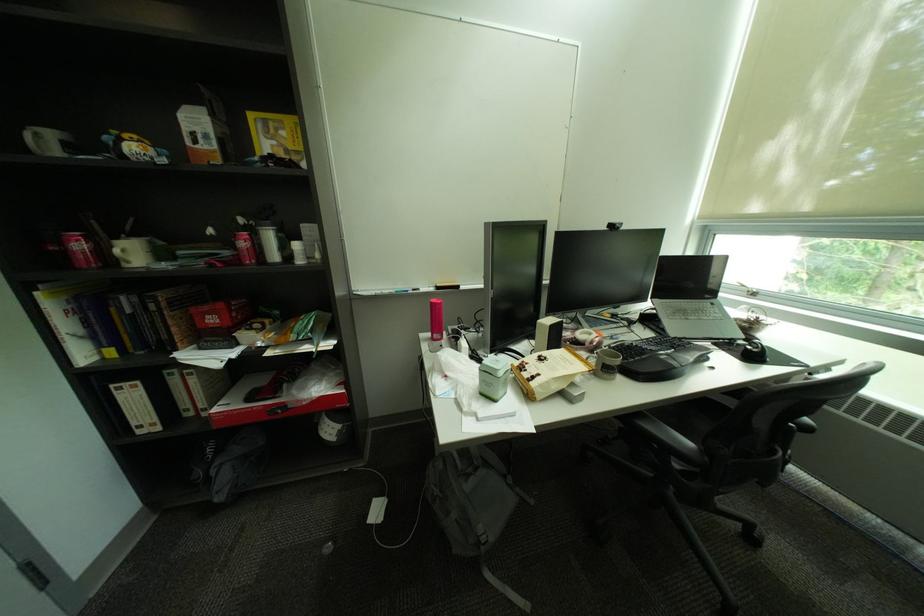
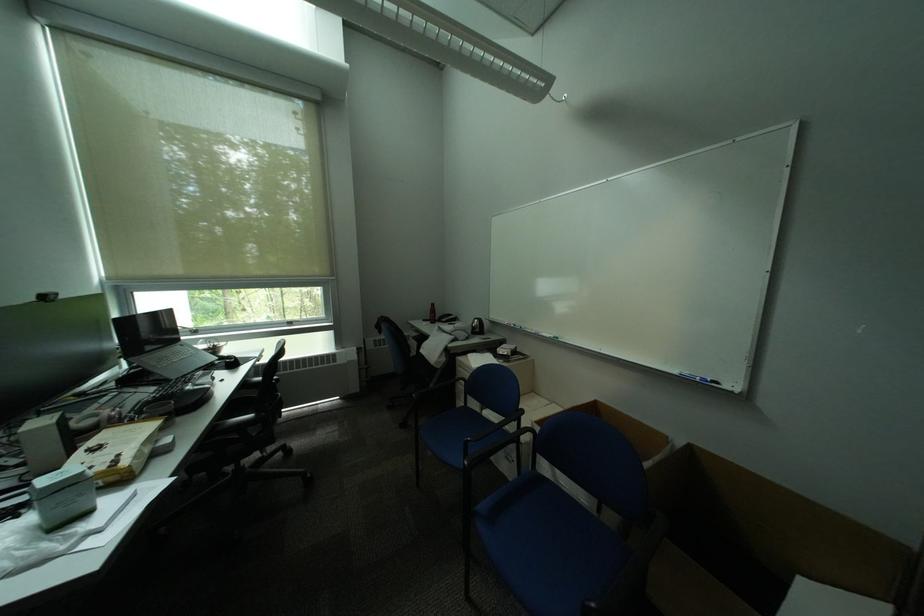
Question: The first image is from the beginning of the video and the second image is from the end. How did the camera likely rotate when shooting the video?

Choices:
 (A) Left
 (B) Right
 (C) Up
 (D) Down

Answer: (B)